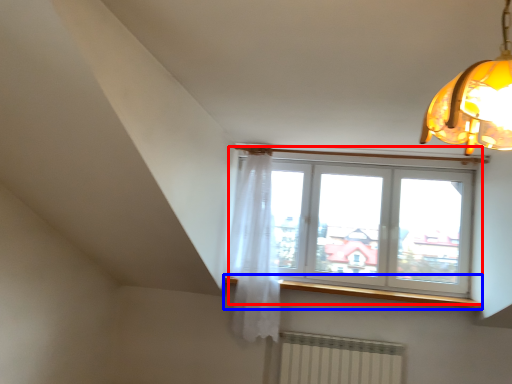
Question: Which point is further to the camera, window (highlighted by a red box) or window sill (highlighted by a blue box)?

Choices:
 (A) window
 (B) window sill

Answer: (A)